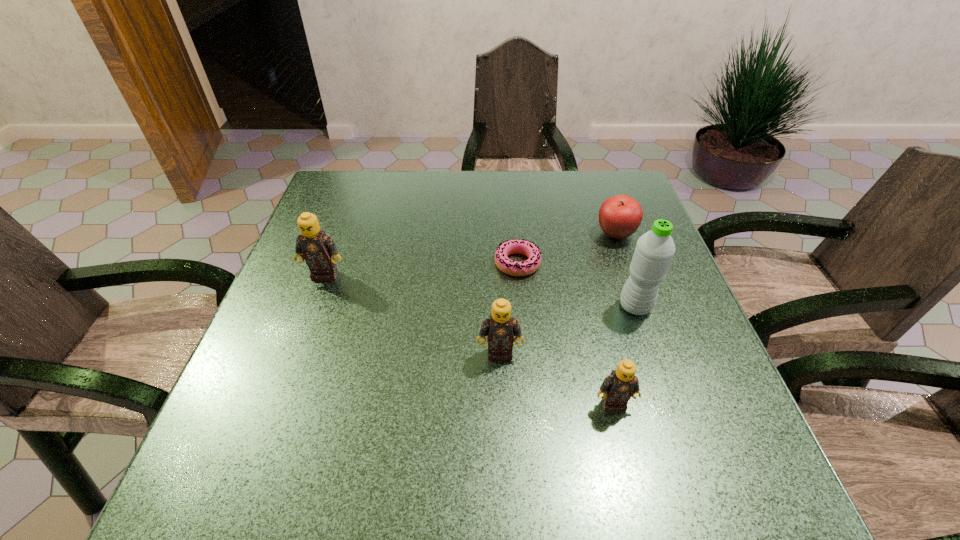
Locate an element on the screen. free space at the near edge of the desktop is located at coordinates (650, 437).

This screenshot has height=540, width=960. What are the coordinates of `vacant space at the left edge of the desktop` in the screenshot? It's located at (288, 280).

At what (x,y) coordinates should I click in order to perform the action: click on free point at the right edge. Please return your answer as a coordinate pair (x, y). The image size is (960, 540). Looking at the image, I should click on (636, 331).

In the image, there is a desktop. Identify the location of vacant region at the far left corner. (341, 200).

You are a GUI agent. You are given a task and a screenshot of the screen. Output one action in this format:
    pyautogui.click(x=<x>, y=<y>)
    Task: Click on the vacant point at the far right corner
    Image resolution: width=960 pixels, height=540 pixels.
    Given the screenshot: What is the action you would take?
    pyautogui.click(x=647, y=212)

Where is `vacant area between the farthest object and the nearest object`? This screenshot has height=540, width=960. vacant area between the farthest object and the nearest object is located at coordinates (614, 319).

You are a GUI agent. You are given a task and a screenshot of the screen. Output one action in this format:
    pyautogui.click(x=<x>, y=<y>)
    Task: Click on the vacant space in between the second Lego from left to right and the nearest object
    The image size is (960, 540).
    Given the screenshot: What is the action you would take?
    pyautogui.click(x=556, y=379)

You are a GUI agent. You are given a task and a screenshot of the screen. Output one action in this format:
    pyautogui.click(x=<x>, y=<y>)
    Task: Click on the free space between the second farthest Lego and the shortest Lego
    This screenshot has height=540, width=960.
    Given the screenshot: What is the action you would take?
    pyautogui.click(x=556, y=379)

The height and width of the screenshot is (540, 960). I want to click on free space that is in between the farthest object and the second Lego from right to left, so click(x=558, y=293).

Image resolution: width=960 pixels, height=540 pixels. What are the coordinates of `empty space between the nearest Lego and the fourth farthest object` in the screenshot? It's located at (624, 355).